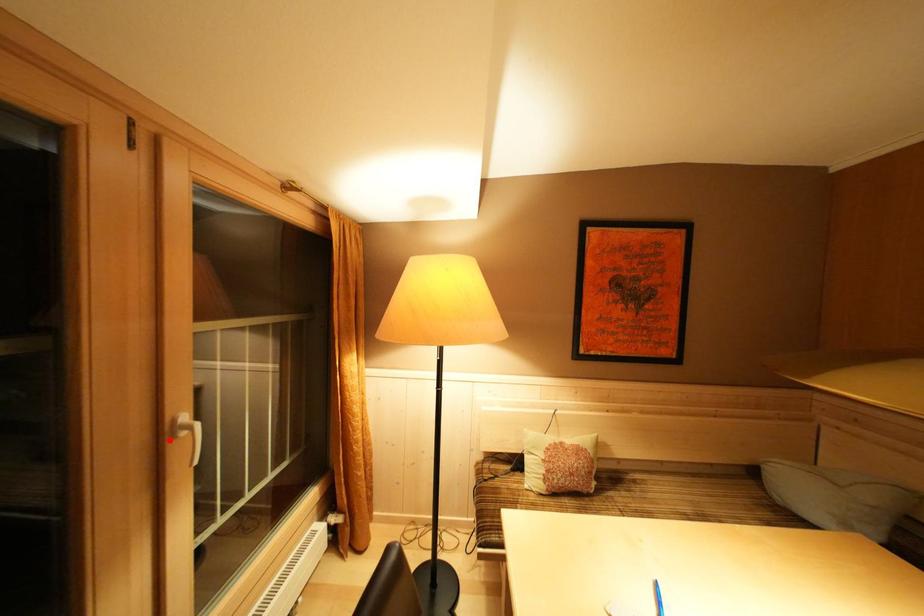
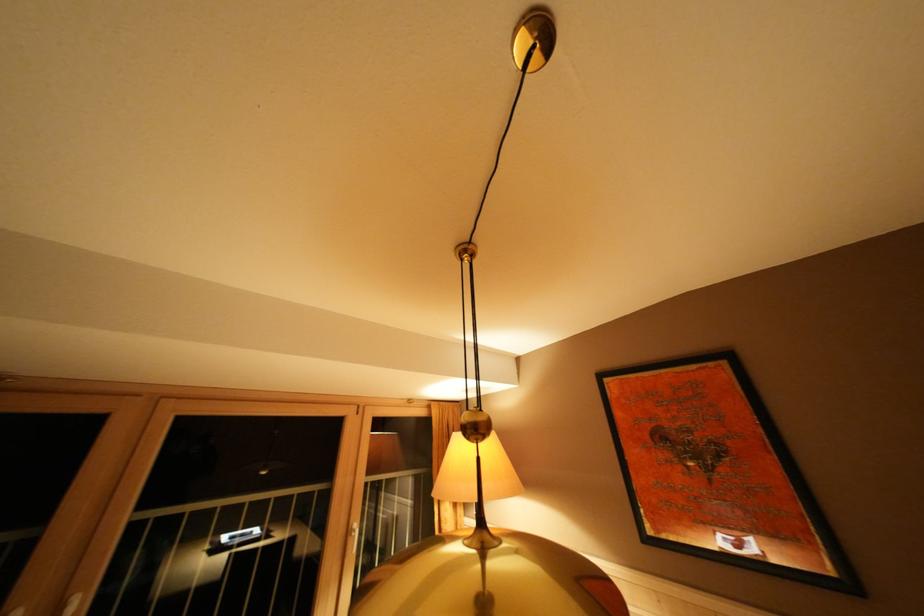
The point at the highlighted location is marked in the first image. Where is the corresponding point in the second image?

(355, 537)